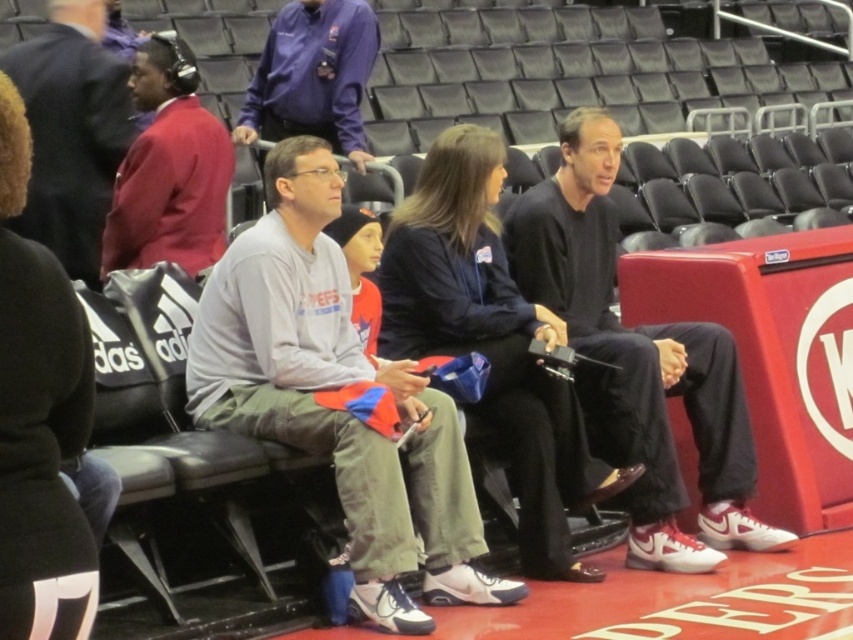
Between black matte pants at center and purple smooth shirt at upper center, which one is positioned higher?

purple smooth shirt at upper center is above.

You are a GUI agent. You are given a task and a screenshot of the screen. Output one action in this format:
    pyautogui.click(x=<x>, y=<y>)
    Task: Click on the black matte pants at center
    
    Given the screenshot: What is the action you would take?
    pyautogui.click(x=637, y=362)

Locate an element on the screen. black matte pants at center is located at coordinates (637, 362).

Can you confirm if dark gray sweatshirt at center is thinner than purple smooth shirt at upper center?

Indeed, dark gray sweatshirt at center has a lesser width compared to purple smooth shirt at upper center.

Does point (73, 216) come in front of point (277, 33)?

Yes, it is.

The height and width of the screenshot is (640, 853). I want to click on dark gray sweatshirt at center, so click(71, 131).

Between gray fleece sweatshirt at center and dark gray sweatshirt at center, which one has more height?

Standing taller between the two is gray fleece sweatshirt at center.

Is gray fleece sweatshirt at center positioned in front of dark gray sweatshirt at center?

Yes.

Image resolution: width=853 pixels, height=640 pixels. I want to click on gray fleece sweatshirt at center, so tap(335, 388).

Find the location of a particular element. The width and height of the screenshot is (853, 640). gray fleece sweatshirt at center is located at coordinates (335, 388).